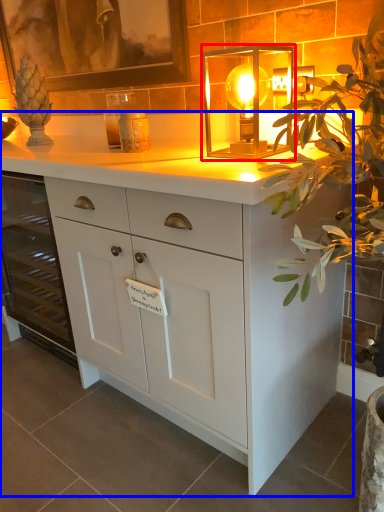
Question: Among these objects, which one is farthest to the camera, lamp (highlighted by a red box) or chest of drawers (highlighted by a blue box)?

Choices:
 (A) lamp
 (B) chest of drawers

Answer: (A)